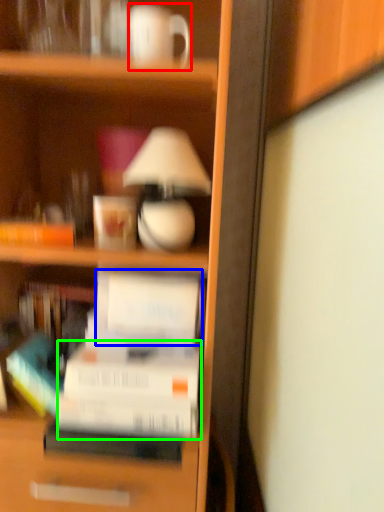
Question: Estimate the real-world distances between objects in this image. Which object is farther from coffee cup (highlighted by a red box), paperback book (highlighted by a blue box) or paperback book (highlighted by a green box)?

Choices:
 (A) paperback book
 (B) paperback book

Answer: (B)